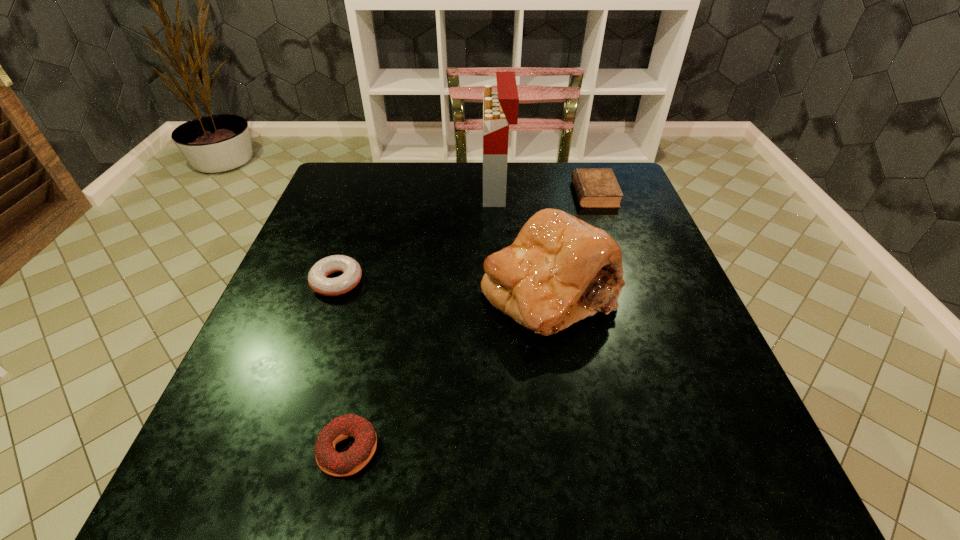
The height and width of the screenshot is (540, 960). Identify the location of blank area in the image that satisfies the following two spatial constraints: 1. on the spine side of the diary; 2. on the filling side of the bread. (629, 292).